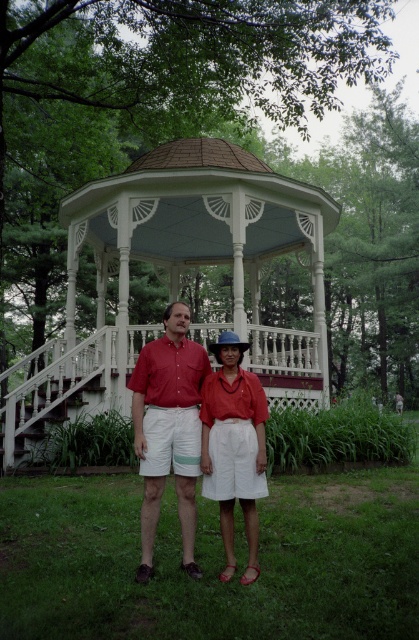
You are a painter who needs to touch up the white painted wood porch at center. You have a ladder that is 15 feet long. If you stand the ladder at the base of the porch, will you be able to reach the matte red shirt at center to ask for help?

The distance between the white painted wood porch at center and the matte red shirt at center is 17.69 feet. Since the ladder is only 15 feet long, the painter cannot reach the matte red shirt at center from the porch with the ladder.

You are standing in the park and want to take a photo of the white painted wood porch at center and the matte red blouse at center. Which object should you focus on first if you want to capture both in the same frame without moving the camera?

You should focus on the matte red blouse at center first because the white painted wood porch at center is above it, so adjusting the camera to include the porch above will naturally include the blouse in the frame.

You are standing in the park and notice the white painted wood porch at center and the matte red shirt at center. Which object is positioned higher from the ground?

The white painted wood porch at center is located above the matte red shirt at center, so it is higher from the ground.